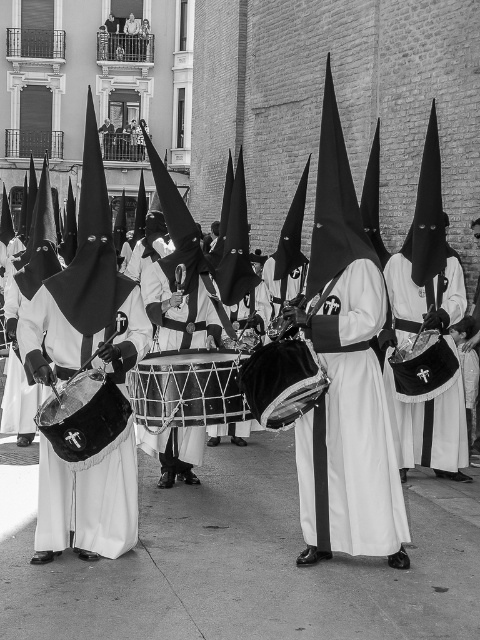
Which is behind, point (66, 353) or point (176, 355)?

Positioned behind is point (176, 355).

Does velvet black drum at left have a larger size compared to velvet drum at center?

No, velvet black drum at left is not bigger than velvet drum at center.

Does point (92, 486) come farther from viewer compared to point (216, 424)?

That is False.

This screenshot has width=480, height=640. I want to click on velvet black drum at left, so 86,502.

Does white matte fabric at center have a larger size compared to smooth black drum at center?

Indeed, white matte fabric at center has a larger size compared to smooth black drum at center.

Between white matte fabric at center and smooth black drum at center, which one is positioned higher?

white matte fabric at center is higher up.

Does point (423, 301) come in front of point (260, 384)?

No, (423, 301) is further to viewer.

At what (x,y) coordinates should I click in order to perform the action: click on white matte fabric at center. Please return your answer as a coordinate pair (x, y). This screenshot has width=480, height=640. Looking at the image, I should click on (431, 428).

Who is taller, velvet drum at center or smooth black drum at center?

Standing taller between the two is smooth black drum at center.

Who is shorter, velvet drum at center or smooth black drum at center?

velvet drum at center

Locate an element on the screen. The image size is (480, 640). velvet drum at center is located at coordinates (188, 388).

At what (x,y) coordinates should I click in order to perform the action: click on velvet drum at center. Please return your answer as a coordinate pair (x, y). Looking at the image, I should click on (188, 388).